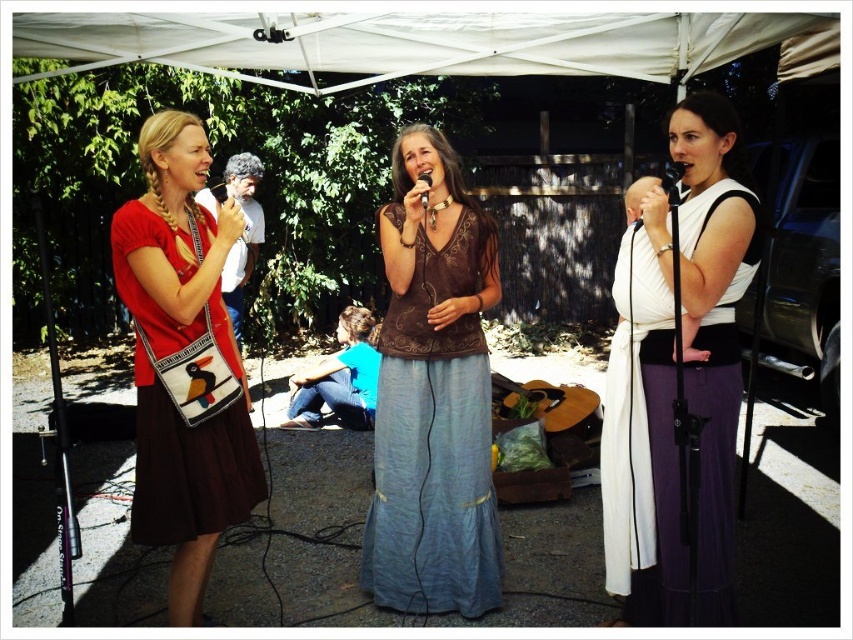
Question: Is brown embroidered top at center positioned behind matte brown purse at left?

Choices:
 (A) no
 (B) yes

Answer: (B)

Question: Which of the following is the closest to the observer?

Choices:
 (A) (149, 442)
 (B) (575, 412)
 (C) (463, 353)
 (D) (421, 196)

Answer: (A)

Question: Among these objects, which one is nearest to the camera?

Choices:
 (A) black matte microphone at upper right
 (B) white silk dress at center

Answer: (B)

Question: Is white fabric canopy at upper center further to the viewer compared to black matte microphone at center?

Choices:
 (A) yes
 (B) no

Answer: (A)

Question: Which of the following is the closest to the observer?

Choices:
 (A) matte brown purse at left
 (B) wooden acoustic guitar at center
 (C) white fabric canopy at upper center

Answer: (A)

Question: Is white fabric canopy at upper center further to camera compared to black matte microphone at upper right?

Choices:
 (A) no
 (B) yes

Answer: (B)